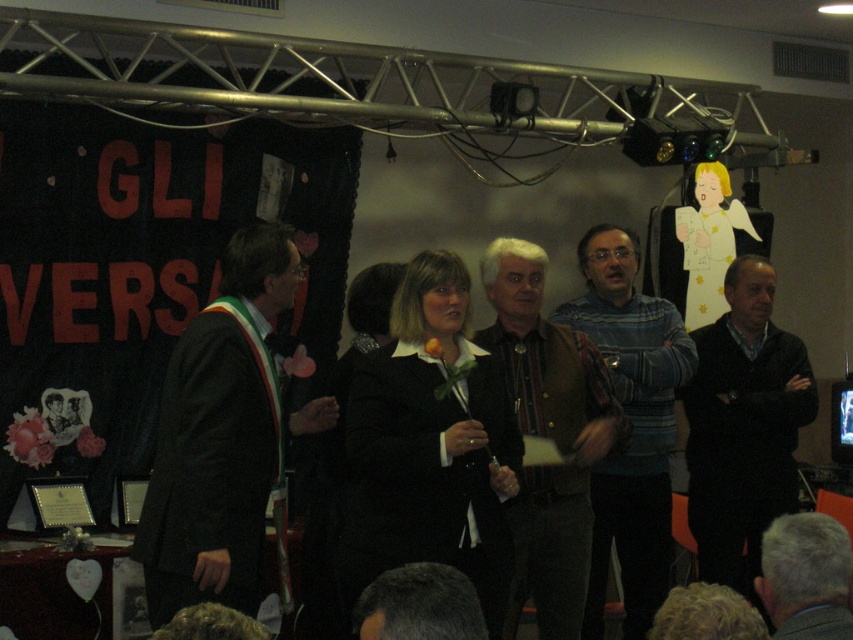
You are an event photographer positioned at the back of the stage. You need to take a photo of both the black matte suit at center and the dark suit at left. Based on their positions, which one is closer to the right side of the stage?

The black matte suit at center is to the right of the dark suit at left, so the black matte suit at center is closer to the right side of the stage.

You are a photographer positioned at the back of the stage. You need to capture a photo where both the dark suit at left and the brown textured sweater at center are visible. Based on their heights, which person should you ensure is standing closer to the front to avoid being blocked?

The dark suit at left is shorter than the brown textured sweater at center. To avoid being blocked, the dark suit at left should be positioned closer to the front of the stage.

You are an event planner observing the stage setup. You need to ensure that the tallest person among the black matte suit at center and the dark suit at left has a microphone stand placed in front of them. Which individual should you adjust the microphone stand for?

The black matte suit at center is much taller than the dark suit at left, so you should adjust the microphone stand for the black matte suit at center to accommodate their height.